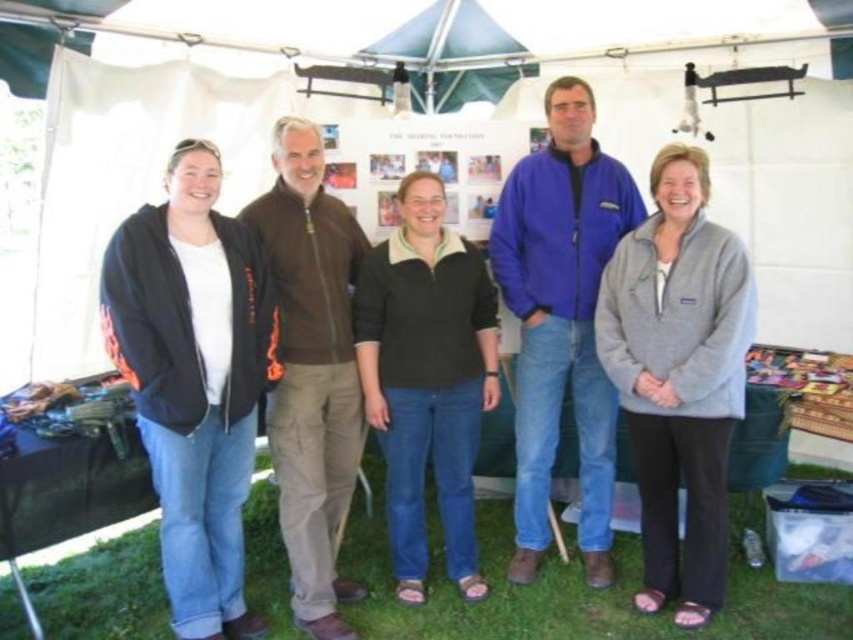
Does point (172, 448) come farther from viewer compared to point (416, 44)?

No, it is in front of (416, 44).

Is black fleece jacket at left below blue fabric canopy at upper center?

Yes, black fleece jacket at left is below blue fabric canopy at upper center.

Identify the location of black fleece jacket at left. (193, 380).

Find the location of a particular element. black fleece jacket at left is located at coordinates (193, 380).

Between black fleece jacket at left and blue fleece jacket at center, which one appears on the left side from the viewer's perspective?

From the viewer's perspective, black fleece jacket at left appears more on the left side.

Who is more forward, (x=236, y=620) or (x=521, y=508)?

Point (x=236, y=620) is in front.

You are a GUI agent. You are given a task and a screenshot of the screen. Output one action in this format:
    pyautogui.click(x=<x>, y=<y>)
    Task: Click on the black fleece jacket at left
    The height and width of the screenshot is (640, 853).
    Given the screenshot: What is the action you would take?
    pyautogui.click(x=193, y=380)

Which of these two, gray fleece jacket at center or brown zip-up jacket at center, stands taller?

With more height is brown zip-up jacket at center.

Is point (641, 308) less distant than point (306, 531)?

Yes.

The height and width of the screenshot is (640, 853). What do you see at coordinates (679, 376) in the screenshot?
I see `gray fleece jacket at center` at bounding box center [679, 376].

Where is `gray fleece jacket at center`? The image size is (853, 640). gray fleece jacket at center is located at coordinates (679, 376).